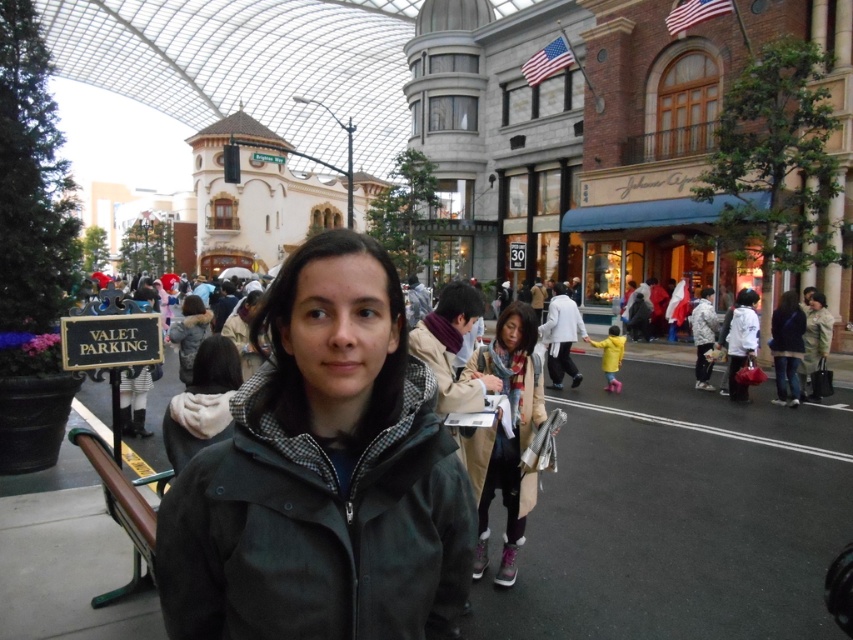
Question: Among these objects, which one is farthest from the camera?

Choices:
 (A) dark green textured jacket at center
 (B) light gray fabric coat at center
 (C) beige wool scarf at center
 (D) matte black jacket at right

Answer: (D)

Question: Estimate the real-world distances between objects in this image. Which object is closer to the light brown fur coat at center?

Choices:
 (A) matte black jacket at right
 (B) dark green textured jacket at center

Answer: (B)

Question: Based on their relative distances, which object is farther from the matte black jacket at right?

Choices:
 (A) light gray fabric coat at center
 (B) beige wool scarf at center
 (C) light brown fur coat at center

Answer: (C)

Question: Can you confirm if beige wool scarf at center is wider than light gray fabric coat at center?

Choices:
 (A) no
 (B) yes

Answer: (B)

Question: Is light brown fur coat at center wider than light gray fabric coat at center?

Choices:
 (A) no
 (B) yes

Answer: (B)

Question: Is matte black jacket at right closer to camera compared to light gray fabric coat at center?

Choices:
 (A) yes
 (B) no

Answer: (B)